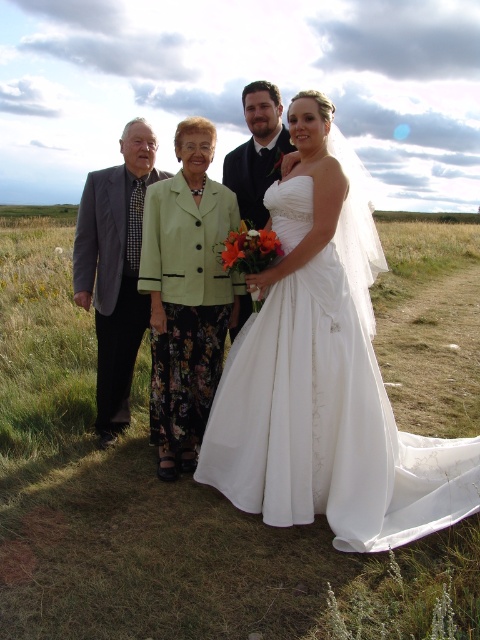
You are standing at the origin point of the coordinate system with the image. You want to move towards the gray suit at left. What are the coordinates you should head towards?

The coordinates you should head towards are 0.420 in the x direction and 0.240 in the y direction.

From the picture: Based on the coordinates provided, which object is located at point (326, 422)?

The point (326, 422) corresponds to the white satin wedding dress at center.

Where is the white satin wedding dress at center located in the image?

The white satin wedding dress at center is located at point (326, 422).